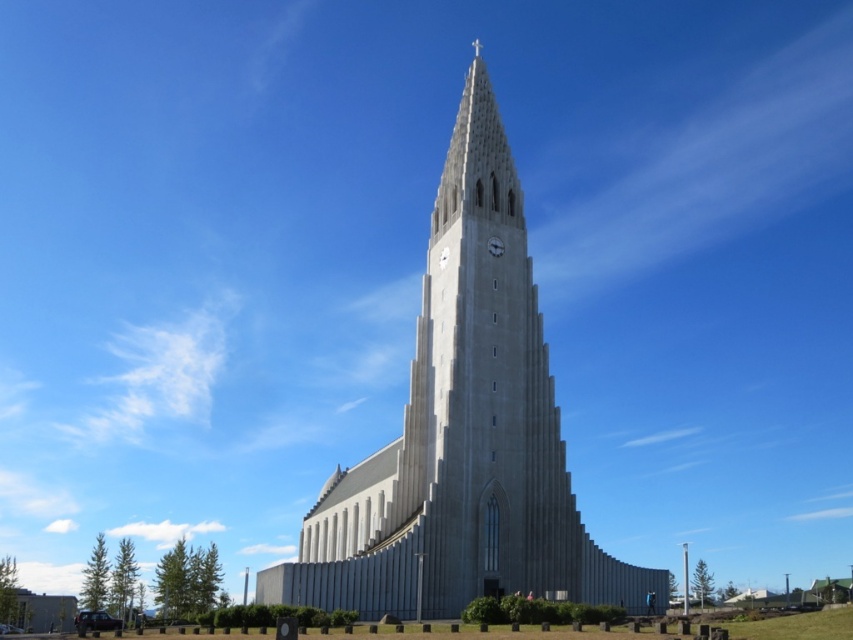
Which is in front, point (366, 532) or point (490, 246)?

Point (366, 532) is in front.

Does gray stone church at center have a larger size compared to metallic gray clock at center?

Indeed, gray stone church at center has a larger size compared to metallic gray clock at center.

The width and height of the screenshot is (853, 640). In order to click on gray stone church at center in this screenshot , I will do `click(463, 433)`.

This screenshot has width=853, height=640. I want to click on gray stone church at center, so click(x=463, y=433).